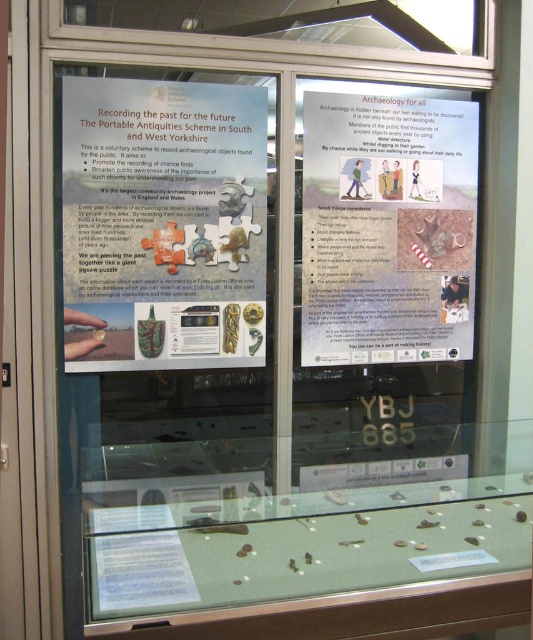
Who is lower down, matte paper poster at center or matte paper poster at upper right?

Positioned lower is matte paper poster at center.

Can you confirm if matte paper poster at center is thinner than matte paper poster at upper right?

No, matte paper poster at center is not thinner than matte paper poster at upper right.

Is point (72, 362) positioned before point (387, 362)?

Yes.

The image size is (533, 640). What are the coordinates of `matte paper poster at center` in the screenshot? It's located at (164, 224).